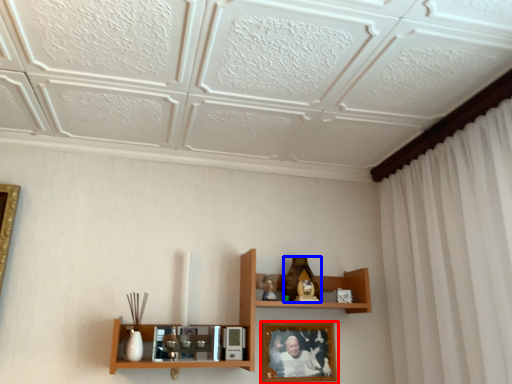
Question: Which object appears closest to the camera in this image, picture frame (highlighted by a red box) or toy (highlighted by a blue box)?

Choices:
 (A) picture frame
 (B) toy

Answer: (A)